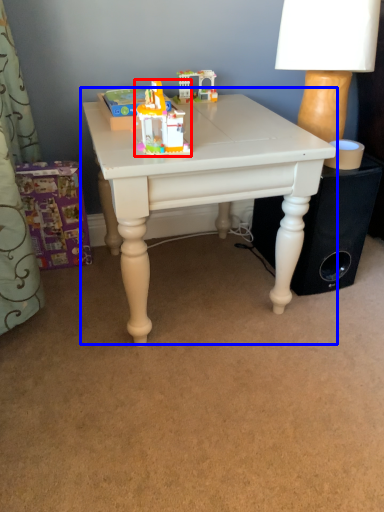
Question: Which object appears closest to the camera in this image, toy (highlighted by a red box) or table (highlighted by a blue box)?

Choices:
 (A) toy
 (B) table

Answer: (A)